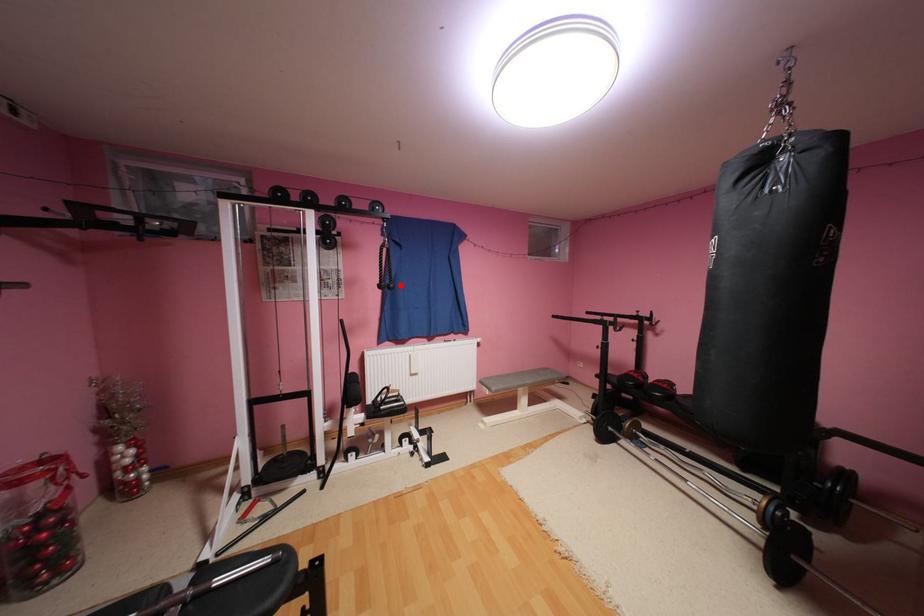
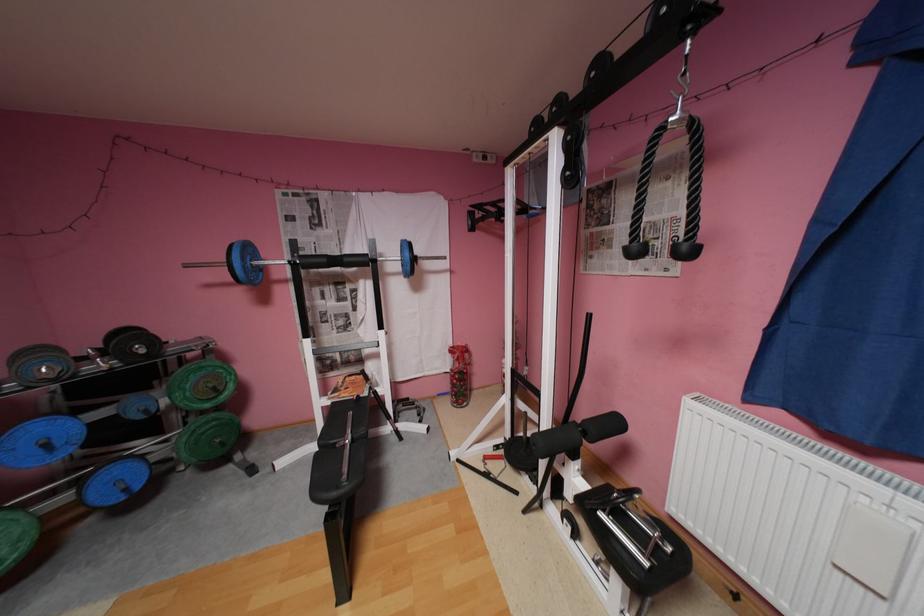
Find the pixel in the second image that matches the highlighted location in the first image.

(695, 246)